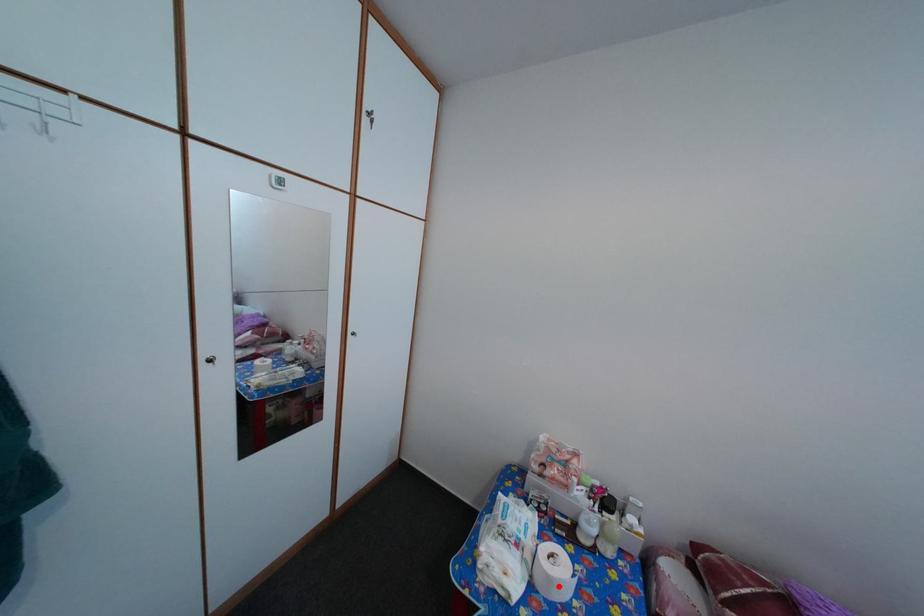
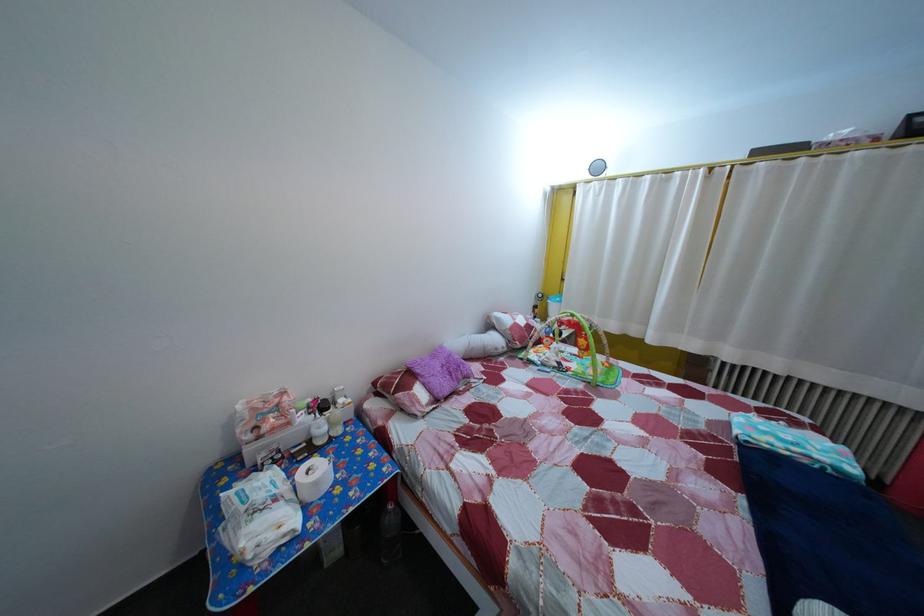
In the second image, find the point that corresponds to the highlighted location in the first image.

(325, 491)